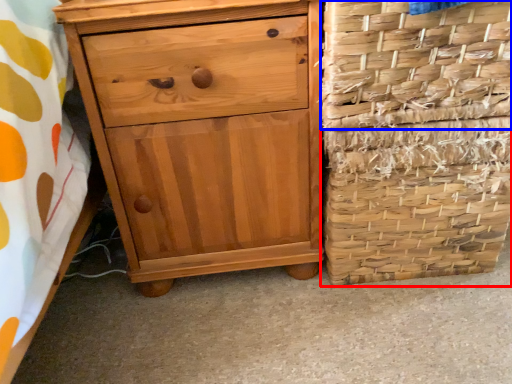
Question: Which point is further to the camera, basket container (highlighted by a red box) or basket (highlighted by a blue box)?

Choices:
 (A) basket container
 (B) basket

Answer: (A)